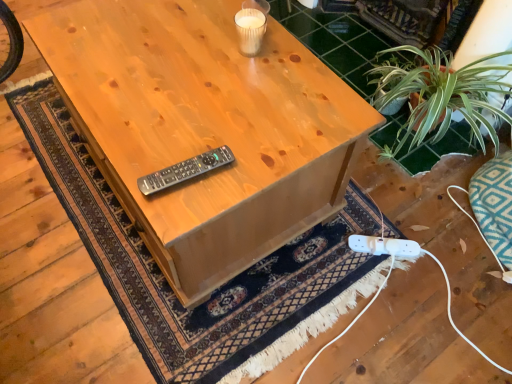
Find the location of a particular element. free spot behind black plastic remote at center is located at coordinates pyautogui.click(x=193, y=119).